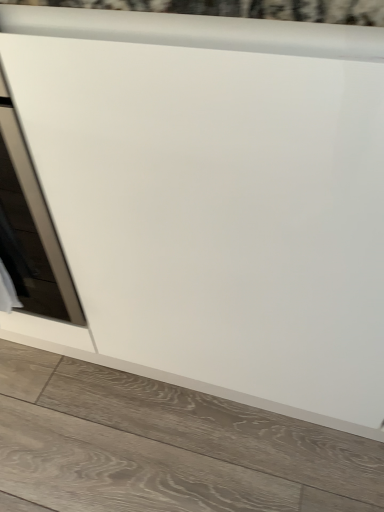
Locate an element on the screen. The height and width of the screenshot is (512, 384). wooden tile at lower center is located at coordinates click(x=164, y=447).

What do you see at coordinates (164, 447) in the screenshot?
I see `wooden tile at lower center` at bounding box center [164, 447].

This screenshot has width=384, height=512. I want to click on wooden tile at lower center, so click(164, 447).